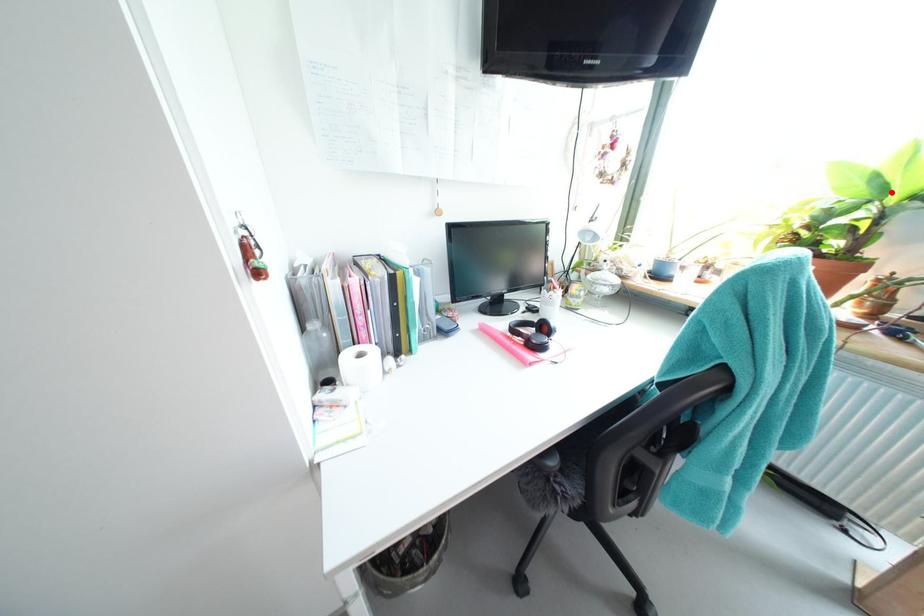
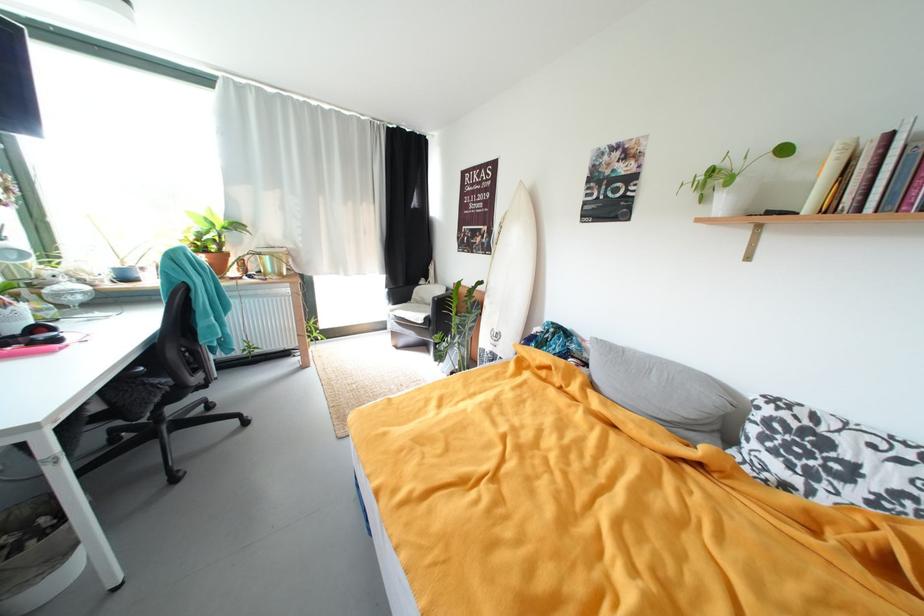
In the second image, find the point that corresponds to the highlighted location in the first image.

(221, 225)